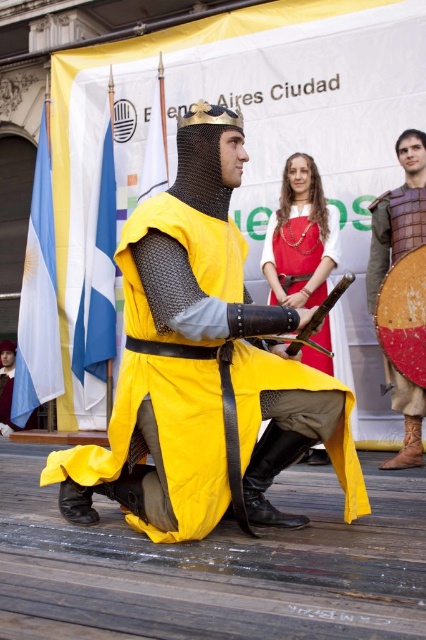
You are a knight standing on the wooden stage and need to grab either the matte gold chainmail helmet at center or the wooden shield at center quickly. Which object can you reach first based on their positions?

The matte gold chainmail helmet at center is closer to the viewer than the wooden shield at center, so you can reach it first.

You are a knight in training observing the scene. You notice both the wooden shield at center and the wooden sword at center. Which object is positioned higher from the ground?

The wooden shield at center is located above the wooden sword at center, so the wooden shield at center is positioned higher from the ground.

You are a knight in training observing the scene. You notice both the wooden shield at center and the wooden sword at center. Which object is positioned to the right of the other?

The wooden shield at center is to the right of the wooden sword at center.